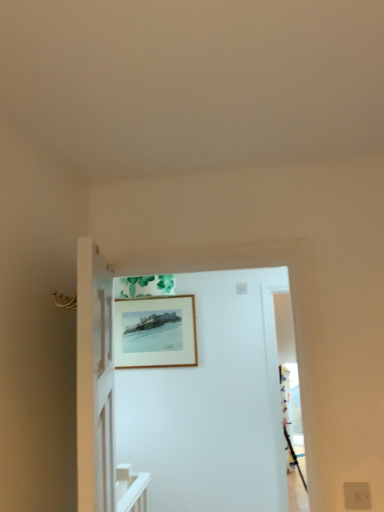
Locate an element on the screen. The width and height of the screenshot is (384, 512). white wooden door at center is located at coordinates (212, 404).

Locate an element on the screen. The width and height of the screenshot is (384, 512). white wooden door at center is located at coordinates (212, 404).

Can you confirm if wooden picture frame at upper center is bigger than white matte electric outlet at lower right?

Yes, wooden picture frame at upper center is bigger than white matte electric outlet at lower right.

What's the angular difference between wooden picture frame at upper center and white matte electric outlet at lower right's facing directions?

The angular difference between wooden picture frame at upper center and white matte electric outlet at lower right is 0.872 degrees.

Is wooden picture frame at upper center next to white matte electric outlet at lower right?

No, wooden picture frame at upper center is not making contact with white matte electric outlet at lower right.

Considering the relative sizes of wooden picture frame at upper center and white matte electric outlet at lower right in the image provided, is wooden picture frame at upper center wider than white matte electric outlet at lower right?

Yes, wooden picture frame at upper center is wider than white matte electric outlet at lower right.

Considering the sizes of objects wooden picture frame at upper center and white wooden door at center in the image provided, who is thinner, wooden picture frame at upper center or white wooden door at center?

wooden picture frame at upper center.

Which object is positioned more to the left, wooden picture frame at upper center or white wooden door at center?

wooden picture frame at upper center is more to the left.

Looking at this image, is wooden picture frame at upper center aimed at white wooden door at center?

Yes.

Would you say wooden picture frame at upper center is inside or outside white wooden door at center?

The correct answer is: outside.

Between white matte electric outlet at lower right and wooden picture frame at upper center, which one is positioned in front?

white matte electric outlet at lower right is closer to the camera.

Is white matte electric outlet at lower right positioned far away from wooden picture frame at upper center?

Yes, white matte electric outlet at lower right is far from wooden picture frame at upper center.

Does white matte electric outlet at lower right appear on the right side of wooden picture frame at upper center?

Yes, white matte electric outlet at lower right is to the right of wooden picture frame at upper center.

Which object is wider, white matte electric outlet at lower right or wooden picture frame at upper center?

wooden picture frame at upper center.

Considering the points (362, 501) and (247, 348), which point is in front, point (362, 501) or point (247, 348)?

Positioned in front is point (362, 501).

Which object is positioned more to the right, white matte electric outlet at lower right or white wooden door at center?

From the viewer's perspective, white matte electric outlet at lower right appears more on the right side.

Is white matte electric outlet at lower right aimed at white wooden door at center?

No, white matte electric outlet at lower right is not oriented towards white wooden door at center.

Based on the photo, considering the relative positions of white wooden door at center and white matte electric outlet at lower right in the image provided, is white wooden door at center to the right of white matte electric outlet at lower right from the viewer's perspective?

No, white wooden door at center is not to the right of white matte electric outlet at lower right.

Can you see white wooden door at center touching white matte electric outlet at lower right?

No, white wooden door at center is not next to white matte electric outlet at lower right.

Is white wooden door at center taller or shorter than white matte electric outlet at lower right?

Considering their sizes, white wooden door at center has more height than white matte electric outlet at lower right.

From the picture: From a real-world perspective, is white wooden door at center positioned above or below white matte electric outlet at lower right?

white wooden door at center is above white matte electric outlet at lower right.

Based on the photo, is the position of white wooden door at center more distant than that of wooden picture frame at upper center?

No, the depth of white wooden door at center is less than that of wooden picture frame at upper center.

Is white wooden door at center bigger or smaller than wooden picture frame at upper center?

In the image, white wooden door at center appears to be larger than wooden picture frame at upper center.

Is white wooden door at center shorter than wooden picture frame at upper center?

Incorrect, the height of white wooden door at center does not fall short of that of wooden picture frame at upper center.

Consider the image. Which object is wider, white wooden door at center or wooden picture frame at upper center?

Wider between the two is white wooden door at center.

Identify the location of picture frame above the white matte electric outlet at lower right (from a real-world perspective). (155, 332).

Where is `door that appears on the right of wooden picture frame at upper center`? door that appears on the right of wooden picture frame at upper center is located at coordinates point(212,404).

When comparing their distances from wooden picture frame at upper center, does white wooden door at center or white matte electric outlet at lower right seem closer?

white wooden door at center is closer to wooden picture frame at upper center.

When comparing their distances from white matte electric outlet at lower right, does white wooden door at center or wooden picture frame at upper center seem closer?

white wooden door at center is closer to white matte electric outlet at lower right.

From the image, which object appears to be farther from white matte electric outlet at lower right, wooden picture frame at upper center or white wooden door at center?

wooden picture frame at upper center.

When comparing their distances from wooden picture frame at upper center, does white matte electric outlet at lower right or white wooden door at center seem further?

The object further to wooden picture frame at upper center is white matte electric outlet at lower right.

Which object lies nearer to the anchor point white wooden door at center, white matte electric outlet at lower right or wooden picture frame at upper center?

Based on the image, wooden picture frame at upper center appears to be nearer to white wooden door at center.

Estimate the real-world distances between objects in this image. Which object is further from white wooden door at center, wooden picture frame at upper center or white matte electric outlet at lower right?

white matte electric outlet at lower right is positioned further to the anchor white wooden door at center.

Where is `door between white matte electric outlet at lower right and wooden picture frame at upper center from front to back`? This screenshot has width=384, height=512. door between white matte electric outlet at lower right and wooden picture frame at upper center from front to back is located at coordinates (212, 404).